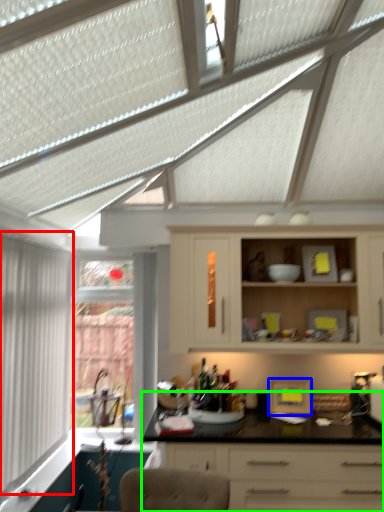
Question: Considering the real-world distances, which object is farthest from window (highlighted by a red box)? appliance (highlighted by a blue box) or countertop (highlighted by a green box)?

Choices:
 (A) appliance
 (B) countertop

Answer: (A)